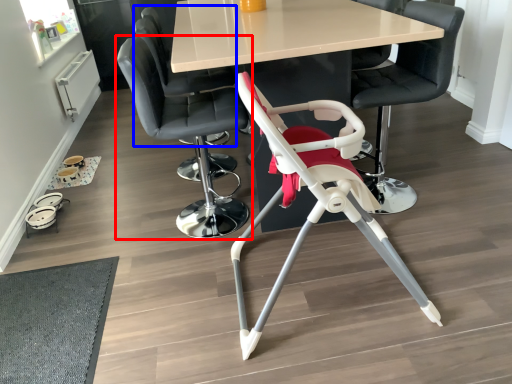
Question: Which object is closer to the camera taking this photo, chair (highlighted by a red box) or chair (highlighted by a blue box)?

Choices:
 (A) chair
 (B) chair

Answer: (A)